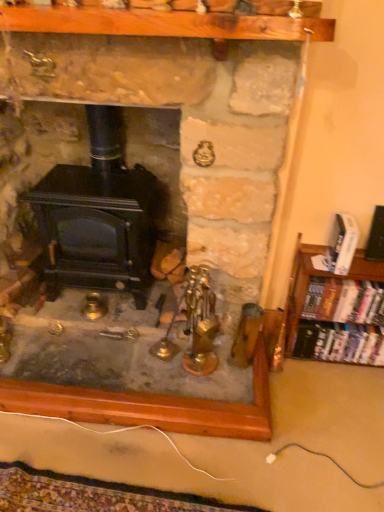
Question: From the image's perspective, is black matte wood burning stove at center above or below white glossy book at right, acting as the 1th book starting from the top?

Choices:
 (A) above
 (B) below

Answer: (A)

Question: In the image, is black matte wood burning stove at center positioned in front of or behind white glossy book at right, the third book from the bottom?

Choices:
 (A) front
 (B) behind

Answer: (B)

Question: Estimate the real-world distances between objects in this image. Which object is farther from the black matte wood burning stove at center?

Choices:
 (A) white glossy book at right, acting as the 1th book starting from the top
 (B) hardcover books at right, which ranks as the third book in top-to-bottom order
 (C) hardcover books at right, the 2th book in the top-to-bottom sequence

Answer: (B)

Question: Which of these objects is positioned farthest from the hardcover books at right, which ranks as the third book in top-to-bottom order?

Choices:
 (A) black matte wood burning stove at center
 (B) hardcover books at right, the 2th book in the top-to-bottom sequence
 (C) white glossy book at right, acting as the 1th book starting from the top

Answer: (A)